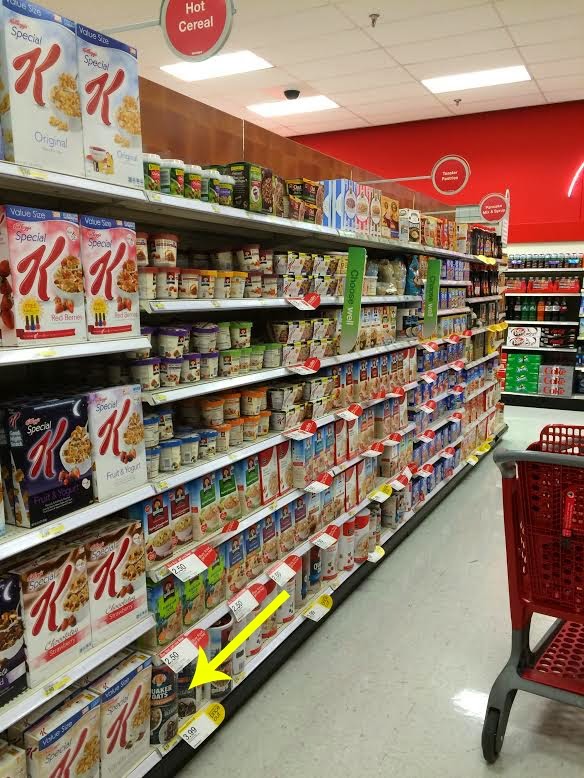
What are the coordinates of `ceiling` in the screenshot? It's located at (493, 13).